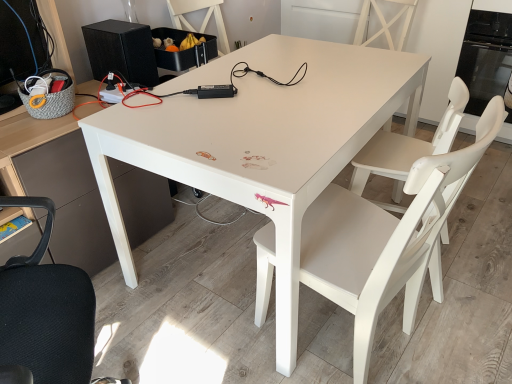
The width and height of the screenshot is (512, 384). What do you see at coordinates (261, 141) in the screenshot?
I see `white matte table at center` at bounding box center [261, 141].

Image resolution: width=512 pixels, height=384 pixels. What do you see at coordinates (121, 51) in the screenshot?
I see `black matte speaker at upper left` at bounding box center [121, 51].

The width and height of the screenshot is (512, 384). Describe the element at coordinates (387, 240) in the screenshot. I see `white matte chair at center` at that location.

Locate an element on the screen. The height and width of the screenshot is (384, 512). white matte chair at center is located at coordinates (458, 157).

Identify the location of chair located above the white matte table at center (from a real-world perspective). This screenshot has height=384, width=512. (387, 240).

Based on the photo, is white matte table at center taller or shorter than white matte chair at center?

Clearly, white matte table at center is shorter compared to white matte chair at center.

Looking at this image, can you confirm if white matte table at center is positioned to the right of white matte chair at center?

No, white matte table at center is not to the right of white matte chair at center.

From a real-world perspective, relative to white matte chair at center, is white matte table at center vertically above or below?

From a real-world perspective, white matte table at center is physically below white matte chair at center.

Is white matte chair at center closer to camera compared to black glass oven at upper right?

Yes, the depth of white matte chair at center is less than that of black glass oven at upper right.

Image resolution: width=512 pixels, height=384 pixels. In order to click on oven lying behind the white matte chair at center in this screenshot , I will do `click(485, 57)`.

Considering the relative sizes of white matte chair at center and black glass oven at upper right in the image provided, is white matte chair at center smaller than black glass oven at upper right?

Incorrect, white matte chair at center is not smaller in size than black glass oven at upper right.

From the image's perspective, relative to black glass oven at upper right, is white matte chair at center above or below?

white matte chair at center is situated lower than black glass oven at upper right in the image.

Is white matte chair at center positioned beyond the bounds of matte black desk at left?

Yes, white matte chair at center is outside of matte black desk at left.

Is white matte chair at center shorter than matte black desk at left?

Correct, white matte chair at center is not as tall as matte black desk at left.

Which of these two, white matte chair at center or matte black desk at left, is thinner?

With smaller width is matte black desk at left.

Is the position of white matte chair at center more distant than that of white matte table at center?

No, it is not.

Does white matte chair at center have a greater height compared to white matte table at center?

Yes, white matte chair at center is taller than white matte table at center.

From the image's perspective, which one is positioned higher, matte black desk at left or white matte table at center?

white matte table at center is shown above in the image.

Can you confirm if matte black desk at left is positioned to the right of white matte table at center?

Incorrect, matte black desk at left is not on the right side of white matte table at center.

From the picture: From a real-world perspective, is matte black desk at left physically located above or below white matte table at center?

matte black desk at left is situated higher than white matte table at center in the real world.

Between matte black desk at left and white matte table at center, which one has less height?

white matte table at center is shorter.

From a real-world perspective, does matte black desk at left sit lower than black matte speaker at upper left?

Yes.

Which object is positioned more to the left, matte black desk at left or black matte speaker at upper left?

Positioned to the left is matte black desk at left.

Is matte black desk at left touching black matte speaker at upper left?

They are not placed beside each other.

Is white matte chair at center far away from white matte table at center?

white matte chair at center is near white matte table at center, not far away.

Choose the correct answer: Is white matte chair at center inside white matte table at center or outside it?

white matte chair at center is contained in white matte table at center.

The image size is (512, 384). What are the coordinates of `armchair that is above the white matte table at center (from a real-world perspective)` in the screenshot? It's located at (458, 157).

Based on their positions, is white matte chair at center located to the left or right of white matte table at center?

From the image, it's evident that white matte chair at center is to the right of white matte table at center.

Find the location of a particular element. chair to the right of white matte table at center is located at coordinates (387, 240).

Locate an element on the screen. This screenshot has height=384, width=512. oven behind the white matte chair at center is located at coordinates (485, 57).

When comparing their distances from matte black desk at left, does white matte table at center or white matte chair at center seem further?

Based on the image, white matte chair at center appears to be further to matte black desk at left.

Based on their spatial positions, is white matte table at center or black glass oven at upper right closer to black matte speaker at upper left?

Among the two, white matte table at center is located nearer to black matte speaker at upper left.

Looking at the image, which one is located closer to white matte chair at center, matte black desk at left or white matte table at center?

white matte table at center is closer to white matte chair at center.

From the image, which object appears to be farther from white matte table at center, white matte chair at center or black matte speaker at upper left?

white matte chair at center is further to white matte table at center.

Looking at the image, which one is located closer to black glass oven at upper right, white matte chair at center or black matte speaker at upper left?

Based on the image, white matte chair at center appears to be nearer to black glass oven at upper right.

Based on their spatial positions, is matte black desk at left or white matte chair at center further from white matte chair at center?

matte black desk at left.

Looking at the image, which one is located further to white matte table at center, matte black desk at left or black glass oven at upper right?

black glass oven at upper right is positioned further to the anchor white matte table at center.

From the image, which object appears to be farther from black glass oven at upper right, white matte chair at center or white matte table at center?

white matte chair at center is positioned further to the anchor black glass oven at upper right.

Locate an element on the screen. The image size is (512, 384). table between matte black desk at left and white matte chair at center in the horizontal direction is located at coordinates (261, 141).

Identify the location of armchair between black matte speaker at upper left and black glass oven at upper right. (458, 157).

The height and width of the screenshot is (384, 512). I want to click on armchair between white matte chair at center and black glass oven at upper right in the front-back direction, so click(458, 157).

I want to click on chair situated between matte black desk at left and black glass oven at upper right from left to right, so click(x=387, y=240).